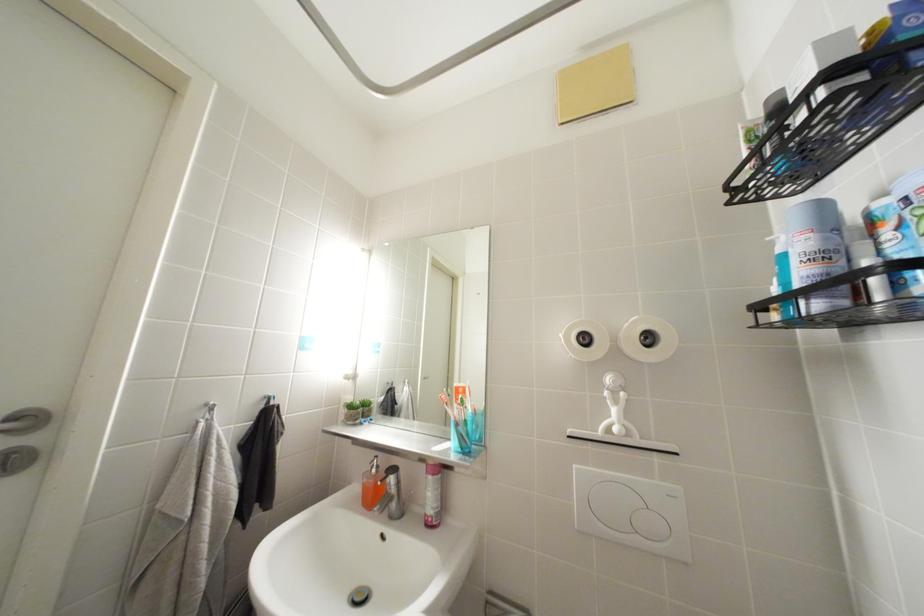
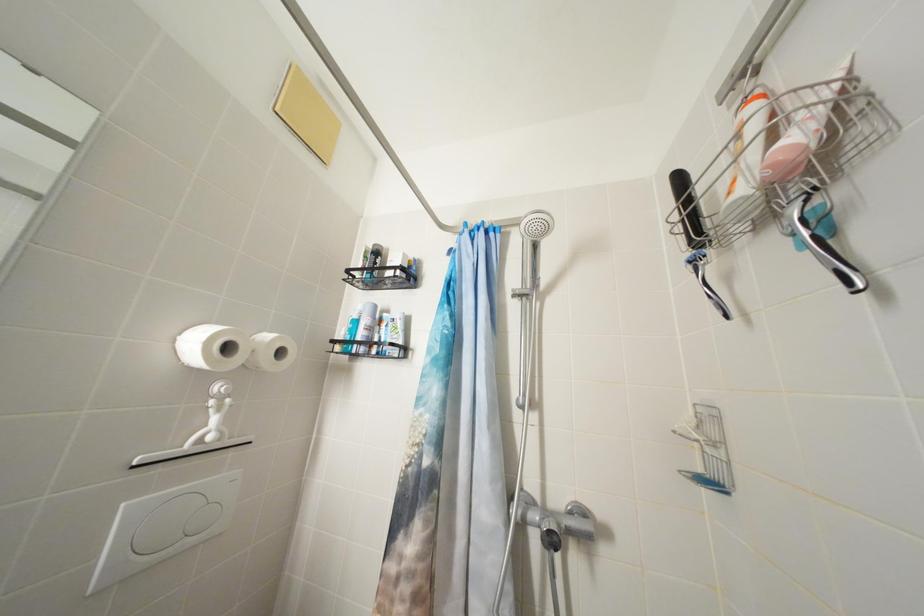
Question: How did the camera likely rotate?

Choices:
 (A) Left
 (B) Right
 (C) Up
 (D) Down

Answer: (B)